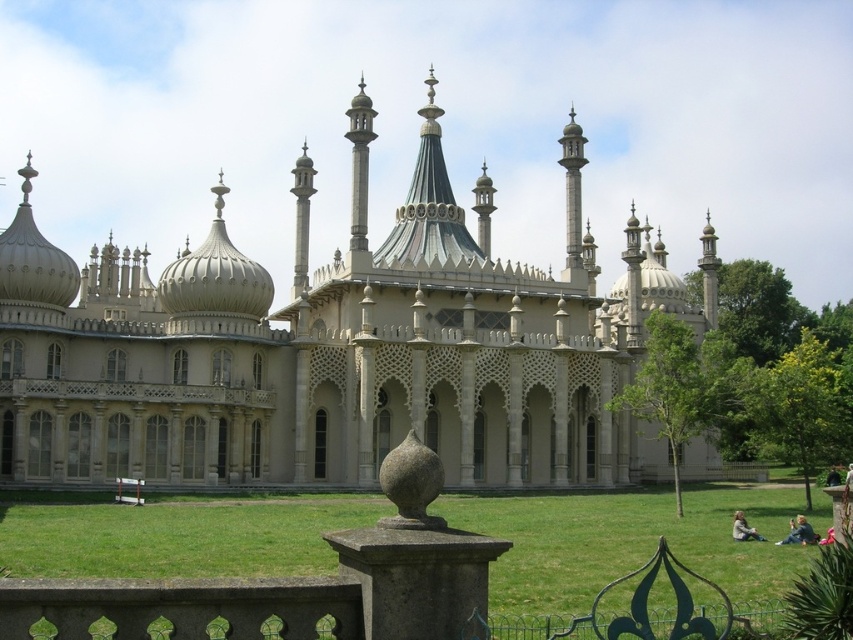
Question: Which point is farther from the camera taking this photo?

Choices:
 (A) (732, 538)
 (B) (109, 544)
 (C) (386, 518)
 (D) (357, 84)

Answer: (D)

Question: Which of the following is the closest to the observer?

Choices:
 (A) (532, 572)
 (B) (786, 541)
 (C) (364, 230)

Answer: (A)

Question: Which point appears closest to the camera in this image?

Choices:
 (A) (782, 541)
 (B) (403, 442)
 (C) (738, 509)

Answer: (B)

Question: Is white stone palace at center below green grass at lower center?

Choices:
 (A) no
 (B) yes

Answer: (A)

Question: Can you confirm if smooth stone spire at center is positioned below blue denim jacket at lower right?

Choices:
 (A) no
 (B) yes

Answer: (A)

Question: Can you confirm if green grass at lower center is positioned to the left of smooth stone vase at center?

Choices:
 (A) yes
 (B) no

Answer: (B)